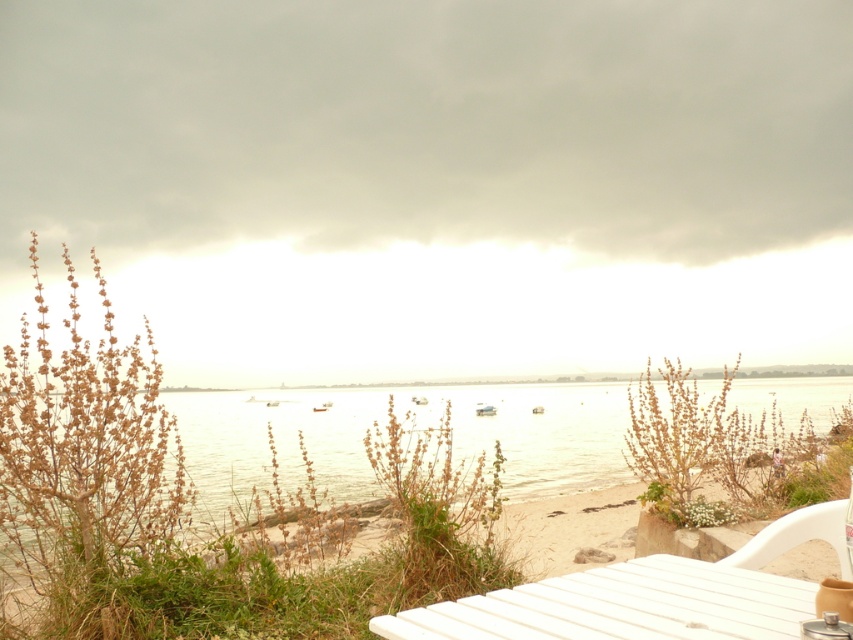
Question: Does clear water at center lie behind white wood table at lower right?

Choices:
 (A) no
 (B) yes

Answer: (B)

Question: Which point appears farthest from the camera in this image?

Choices:
 (A) (491, 440)
 (B) (706, 573)
 (C) (769, 550)

Answer: (A)

Question: Is white wood table at lower right to the right of white plastic chair at lower right from the viewer's perspective?

Choices:
 (A) no
 (B) yes

Answer: (A)

Question: Which point is closer to the camera?

Choices:
 (A) (349, 436)
 (B) (700, 586)

Answer: (B)

Question: Can you confirm if white wood table at lower right is positioned below white plastic chair at lower right?

Choices:
 (A) no
 (B) yes

Answer: (A)

Question: Which point is closer to the camera?

Choices:
 (A) (788, 534)
 (B) (196, 452)
 (C) (692, 632)

Answer: (C)